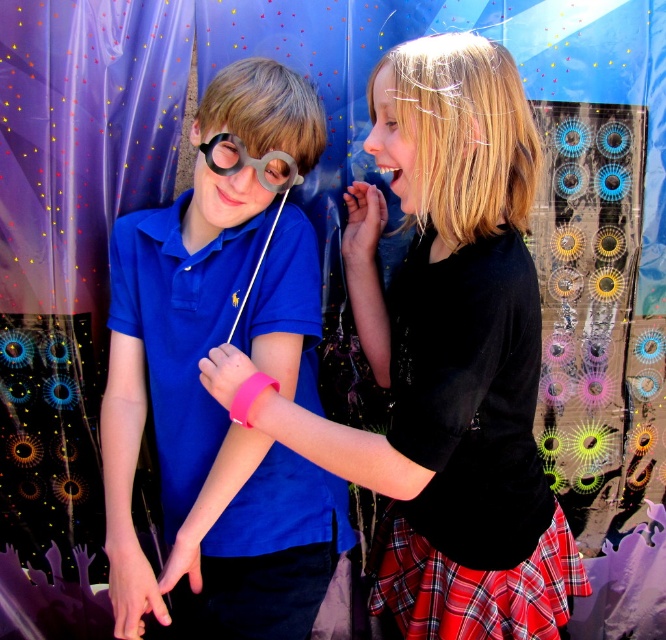
Measure the distance from blue matte shirt at center to black paper at center.

blue matte shirt at center and black paper at center are 13.85 inches apart.

Is blue matte shirt at center taller than black paper at center?

Yes, blue matte shirt at center is taller than black paper at center.

You are a GUI agent. You are given a task and a screenshot of the screen. Output one action in this format:
    pyautogui.click(x=<x>, y=<y>)
    Task: Click on the blue matte shirt at center
    This screenshot has width=666, height=640.
    Given the screenshot: What is the action you would take?
    pyautogui.click(x=204, y=433)

At what (x,y) coordinates should I click in order to perform the action: click on blue matte shirt at center. Please return your answer as a coordinate pair (x, y). Image resolution: width=666 pixels, height=640 pixels. Looking at the image, I should click on (204, 433).

Is black matte dress at center in front of blue matte shirt at center?

Yes, it is in front of blue matte shirt at center.

Which is behind, point (496, 412) or point (165, 572)?

Positioned behind is point (165, 572).

Between point (470, 586) and point (111, 548), which one is positioned behind?

Positioned behind is point (111, 548).

You are a GUI agent. You are given a task and a screenshot of the screen. Output one action in this format:
    pyautogui.click(x=<x>, y=<y>)
    Task: Click on the black matte dress at center
    This screenshot has height=640, width=666.
    Given the screenshot: What is the action you would take?
    pyautogui.click(x=444, y=356)

Looking at this image, between black matte dress at center and black paper at center, which one appears on the left side from the viewer's perspective?

Positioned to the left is black paper at center.

Between black matte dress at center and black paper at center, which one is positioned higher?

black paper at center is higher up.

Is point (432, 269) farther from viewer compared to point (248, 156)?

Yes, point (432, 269) is behind point (248, 156).

Where is `black matte dress at center`? black matte dress at center is located at coordinates (444, 356).